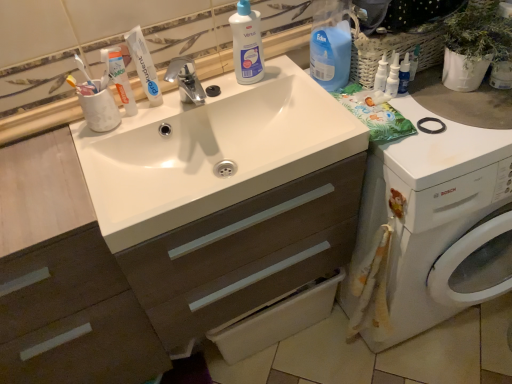
What are the coordinates of `unoccupied region to the right of white glossy toothpaste tube at upper left` in the screenshot? It's located at (186, 102).